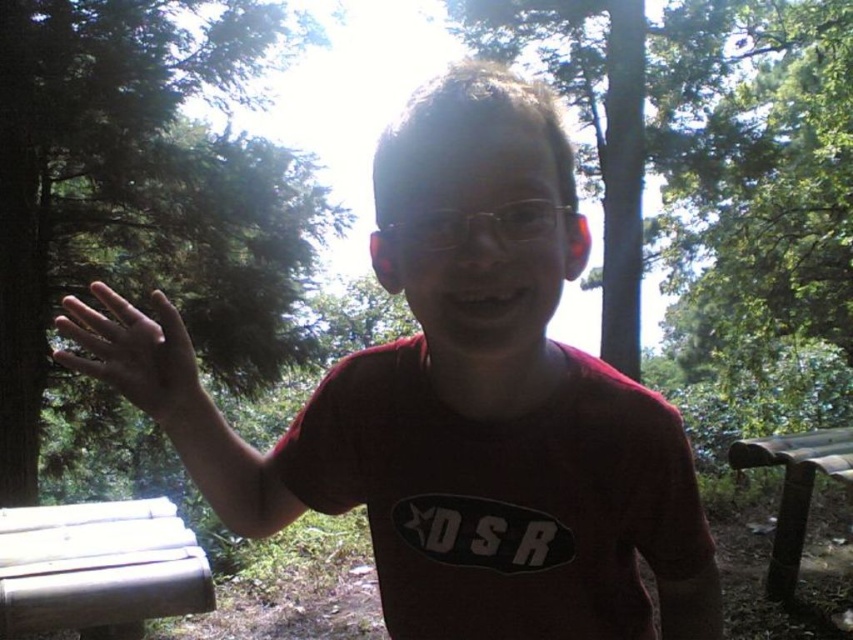
Can you confirm if matte red t-shirt at center is bigger than white wood bench at lower left?

Yes, matte red t-shirt at center is bigger than white wood bench at lower left.

Is matte red t-shirt at center above white wood bench at lower left?

Yes, matte red t-shirt at center is above white wood bench at lower left.

Is point (297, 456) less distant than point (178, 577)?

Yes, point (297, 456) is in front of point (178, 577).

This screenshot has height=640, width=853. In order to click on matte red t-shirt at center in this screenshot , I will do `click(456, 452)`.

You are a GUI agent. You are given a task and a screenshot of the screen. Output one action in this format:
    pyautogui.click(x=<x>, y=<y>)
    Task: Click on the smooth skin hand at left
    This screenshot has height=640, width=853.
    Given the screenshot: What is the action you would take?
    coord(141,362)

Is smooth skin hand at left smaller than brown wooden bench at lower right?

Correct, smooth skin hand at left occupies less space than brown wooden bench at lower right.

Between point (111, 333) and point (773, 458), which one is positioned behind?

Positioned behind is point (773, 458).

The width and height of the screenshot is (853, 640). What are the coordinates of `smooth skin hand at left` in the screenshot? It's located at (141, 362).

Is matte red t-shirt at center bigger than brown wooden bench at lower right?

Correct, matte red t-shirt at center is larger in size than brown wooden bench at lower right.

Can you confirm if matte red t-shirt at center is smaller than brown wooden bench at lower right?

No, matte red t-shirt at center is not smaller than brown wooden bench at lower right.

Between point (399, 541) and point (805, 499), which one is positioned behind?

Positioned behind is point (805, 499).

Where is `matte red t-shirt at center`? This screenshot has height=640, width=853. matte red t-shirt at center is located at coordinates (456, 452).